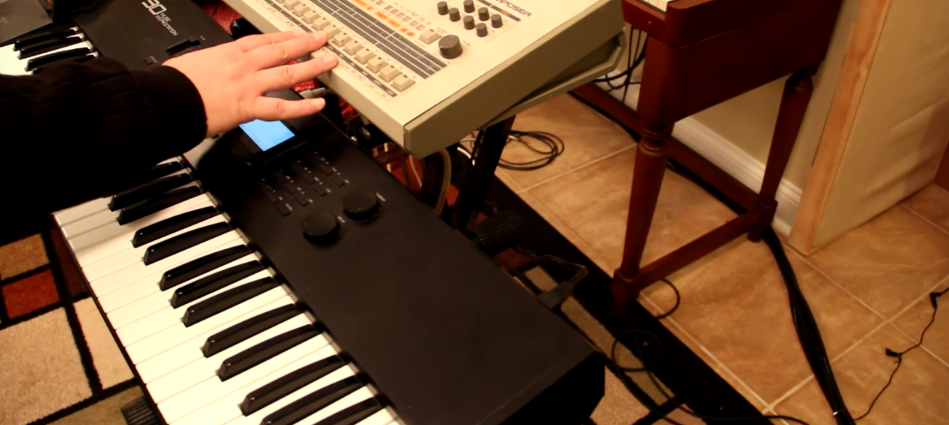
The height and width of the screenshot is (425, 949). In order to click on rug in this screenshot , I will do `click(40, 359)`.